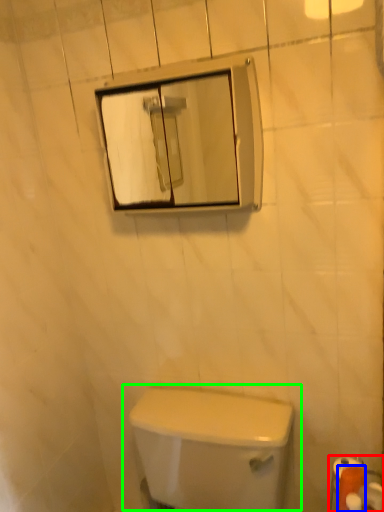
Question: Which is farther away from toilet paper (highlighted by a red box)? toilet paper (highlighted by a blue box) or toilet (highlighted by a green box)?

Choices:
 (A) toilet paper
 (B) toilet

Answer: (B)